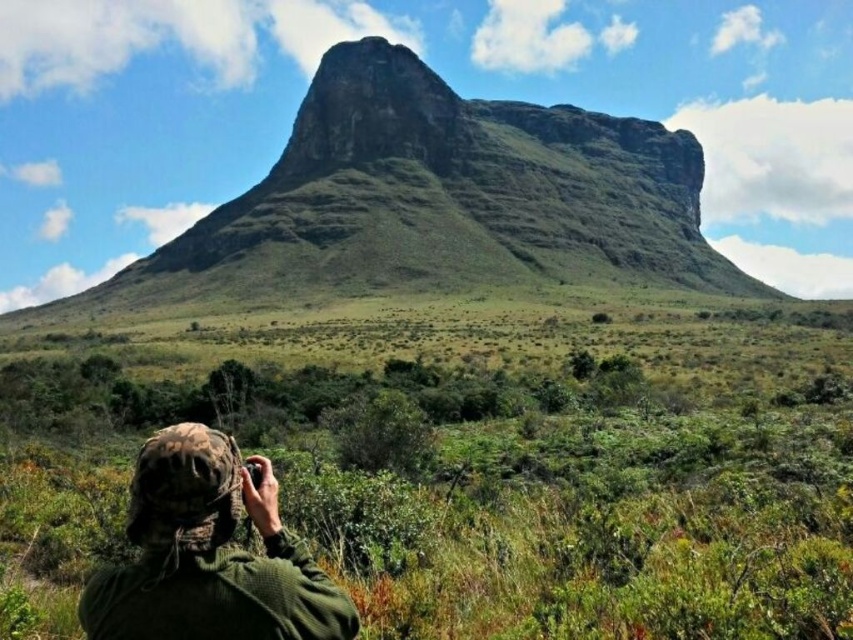
You are standing in the outdoor scene and want to take a photo of the green grassy mountain at center. The camo fabric hat at lower left is blocking your view. Can you move the hat to the side to get a clear shot?

The green grassy mountain at center is further to the viewer than the camo fabric hat at lower left, so moving the hat to the side would allow you to get a clear shot of the mountain.

You are standing at point [209,445] and want to walk to the mountain peak. There is another point at [210,230]. Which point should you head towards to get closer to the mountain?

You should head towards point [210,230] because it is behind point [209,445], meaning it is closer to the mountain peak.